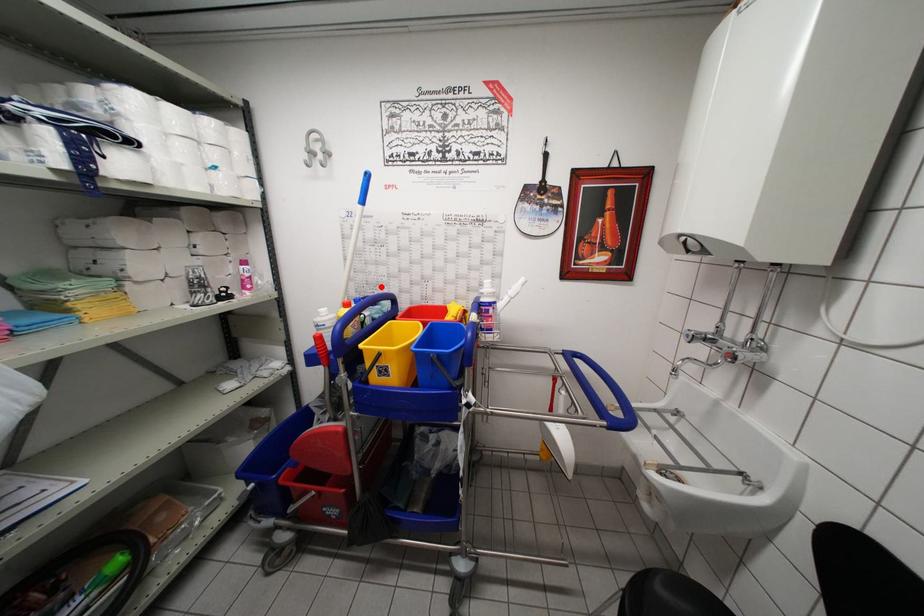
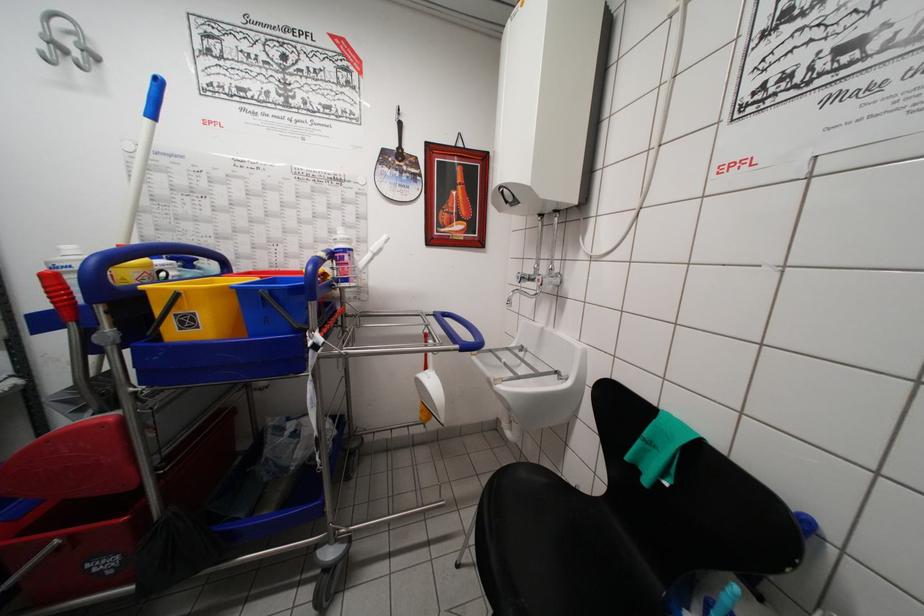
Where in the second image is the point corresponding to the highlighted location from the first image?

(203, 249)